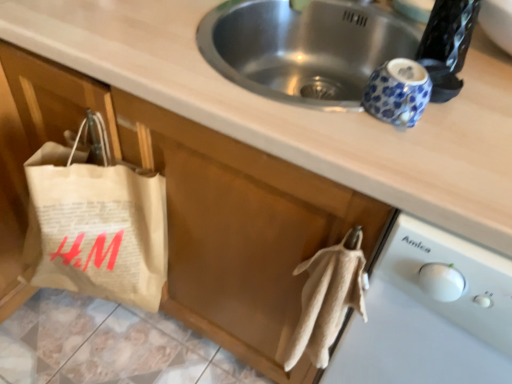
Question: Considering the relative sizes of natural paper bag at left and white plastic dishwasher at lower right in the image provided, is natural paper bag at left wider than white plastic dishwasher at lower right?

Choices:
 (A) no
 (B) yes

Answer: (A)

Question: Does natural paper bag at left appear on the right side of white plastic dishwasher at lower right?

Choices:
 (A) no
 (B) yes

Answer: (A)

Question: Does natural paper bag at left have a smaller size compared to white plastic dishwasher at lower right?

Choices:
 (A) yes
 (B) no

Answer: (A)

Question: From a real-world perspective, is natural paper bag at left on white plastic dishwasher at lower right?

Choices:
 (A) yes
 (B) no

Answer: (A)

Question: Is natural paper bag at left next to white plastic dishwasher at lower right and touching it?

Choices:
 (A) yes
 (B) no

Answer: (B)

Question: Is natural paper bag at left aimed at white plastic dishwasher at lower right?

Choices:
 (A) yes
 (B) no

Answer: (B)

Question: From the image's perspective, is white plastic dishwasher at lower right located beneath natural paper bag at left?

Choices:
 (A) yes
 (B) no

Answer: (A)

Question: Does white plastic dishwasher at lower right come in front of natural paper bag at left?

Choices:
 (A) yes
 (B) no

Answer: (A)

Question: Is the depth of white plastic dishwasher at lower right greater than that of natural paper bag at left?

Choices:
 (A) no
 (B) yes

Answer: (A)

Question: Can you confirm if white plastic dishwasher at lower right is bigger than natural paper bag at left?

Choices:
 (A) no
 (B) yes

Answer: (B)

Question: Are white plastic dishwasher at lower right and natural paper bag at left located far from each other?

Choices:
 (A) yes
 (B) no

Answer: (B)

Question: Does white plastic dishwasher at lower right have a greater width compared to natural paper bag at left?

Choices:
 (A) no
 (B) yes

Answer: (B)

Question: Would you say natural paper bag at left is inside or outside white plastic dishwasher at lower right?

Choices:
 (A) outside
 (B) inside

Answer: (A)